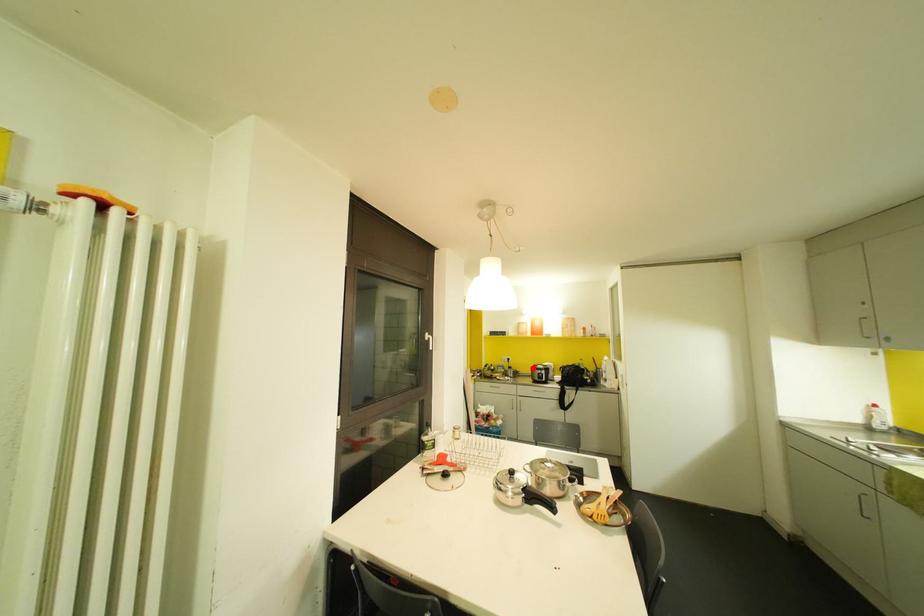
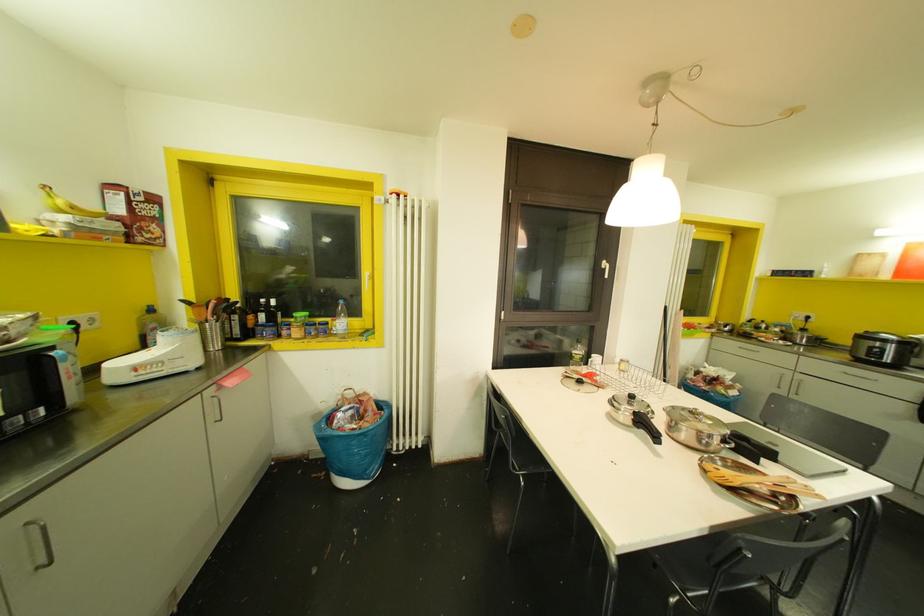
Locate, in the second image, the point that corresponds to the highlighted location in the first image.

(861, 336)